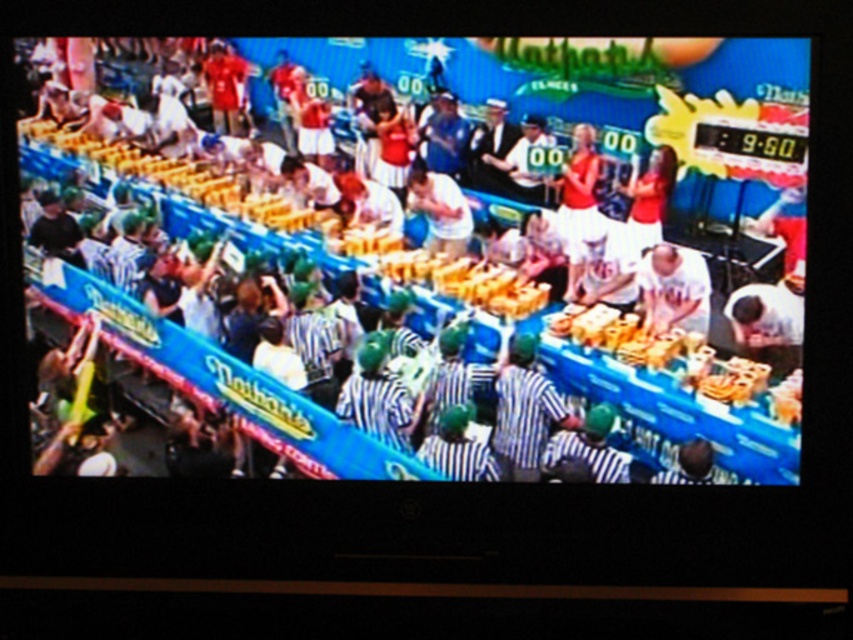
You are a photographer at the Nathan hot dog eating contest. You want to take a photo of the contestant wearing the white striped shirt at center. Where should you aim your camera to capture them?

The white striped shirt at center is located at point 0.372 on the x axis and 0.499 on the y axis, so you should aim your camera at those coordinates to capture them.

You are a photographer at the Nathan hot dog eating contest. You need to capture a photo of the two contestants wearing the white striped shirt at center and white matte shirt at center. Which contestant should you focus on first if you want to include both in the frame without cropping?

The white striped shirt at center is bigger than the white matte shirt at center, so you should focus on the white striped shirt at center first to ensure it fits in the frame along with the smaller white matte shirt at center.

You are a photographer standing behind the contestants at the Nathan hot dog eating contest. You want to take a photo of the white striped shirt at center and the white matte shirt at center. The camera you are using has a maximum focus range of 12 inches. Can you capture both subjects in focus without moving the camera?

The distance between the white striped shirt at center and the white matte shirt at center is 13.08 inches, which exceeds the camera focus range of 12 inches. Therefore, you cannot capture both in focus without moving the camera.